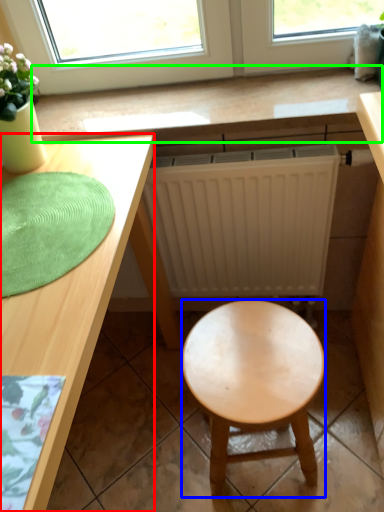
Question: Estimate the real-world distances between objects in this image. Which object is closer to desk (highlighted by a red box), stool (highlighted by a blue box) or counter top (highlighted by a green box)?

Choices:
 (A) stool
 (B) counter top

Answer: (B)